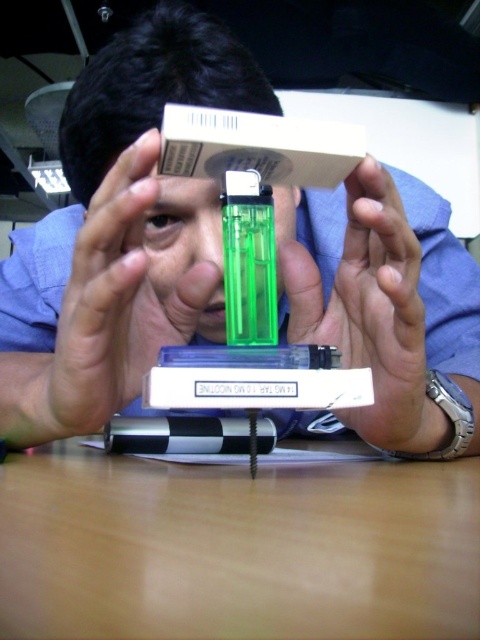
You are a quality control inspector checking the dimensions of items in the image. The standard requires that the matte green plastic hand at center must be wider than the matte green plastic lighter at center. Does the current setup meet this requirement?

The matte green plastic lighter at center has a larger width than the matte green plastic hand at center, so the current setup does not meet the requirement that the matte green plastic hand at center must be wider.

Based on the photo, you are a person trying to place the transparent plastic lighter at center onto the brown matte table at center. Can you place it directly on the table without moving any other objects?

The transparent plastic lighter at center is already above the brown matte table at center, so yes, you can place it directly on the table without moving any other objects.

You are a person trying to place the transparent plastic lighter at center on the brown matte table at center. Can you do it without the lighter falling off?

The transparent plastic lighter at center has a greater height compared to brown matte table at center, so it can be placed on the table without falling off as long as it is positioned properly.